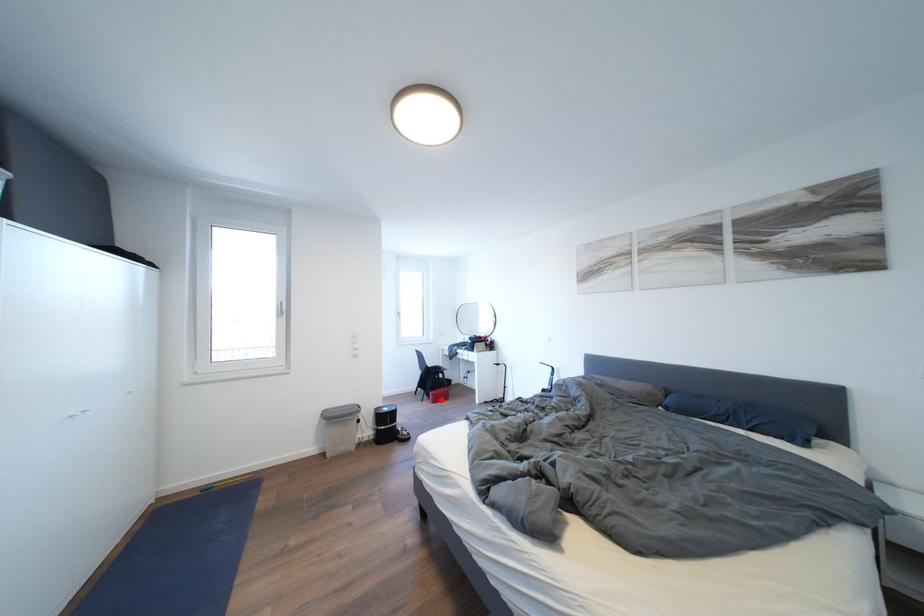
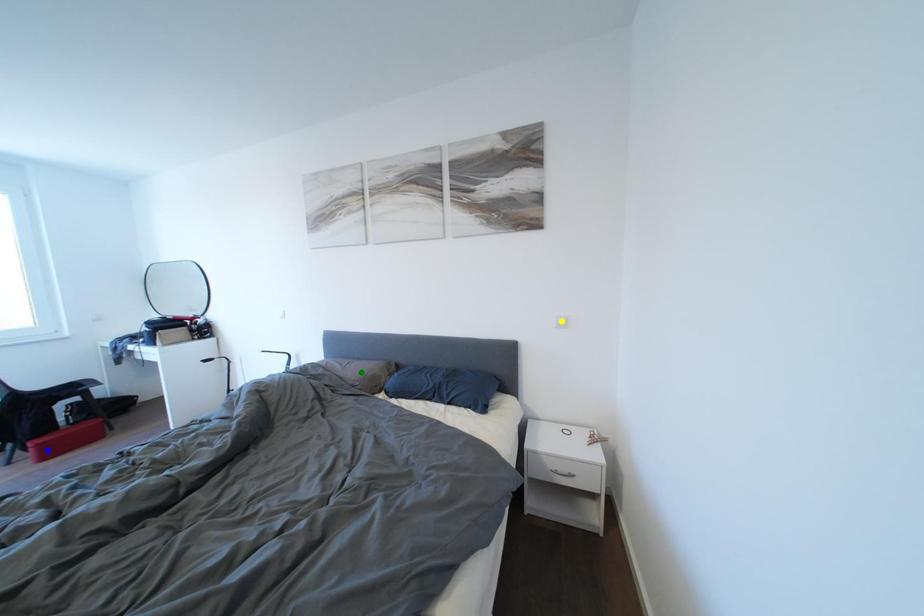
Question: I am providing you with two images of the same scene from different viewpoints. A red point is marked on the first image. You are given multiple points on the second image. Which point in image 2 is actually the same real-world point as the red point in image 1?

Choices:
 (A) green point
 (B) blue point
 (C) yellow point

Answer: (B)